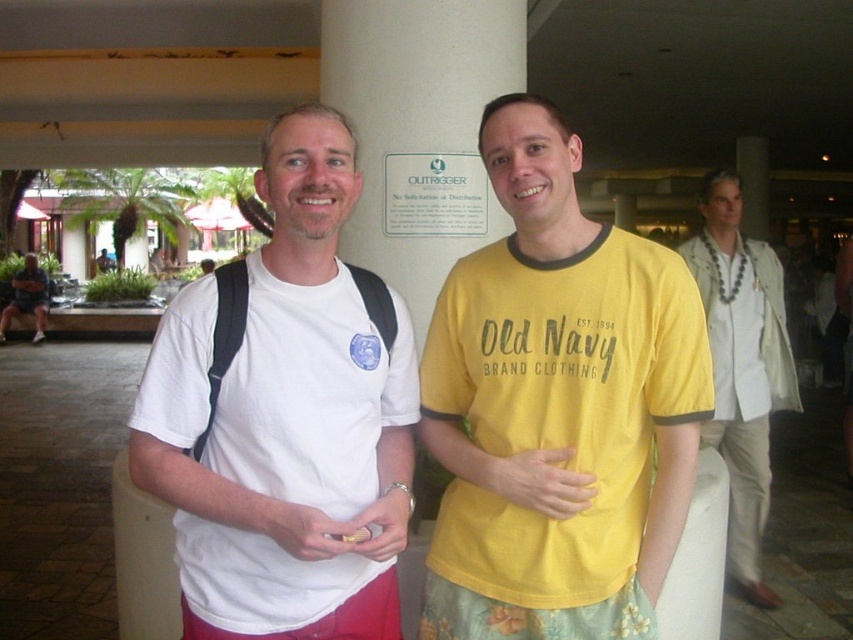
You are a photographer standing in the lobby and want to take a photo of the two people. The camera you are using has a minimum focus distance of 1.5 meters. Can you focus on the point at point (538, 170) without moving closer?

The point at point (538, 170) is 1.65 meters away from the camera, which is beyond the minimum focus distance of 1.5 meters. Therefore, the camera can focus on the point at point (538, 170) without needing to move closer.

Consider the image. You are planning to hang a picture frame on the wall behind the white smooth pillar at center and the gray fabric shirt at right. Which object should you avoid placing the frame near if you want to ensure it doesn

The gray fabric shirt at right is larger than the white smooth pillar at center, so placing the frame near the gray fabric shirt at right might require more space and could be less ideal if you want to avoid obstruction.